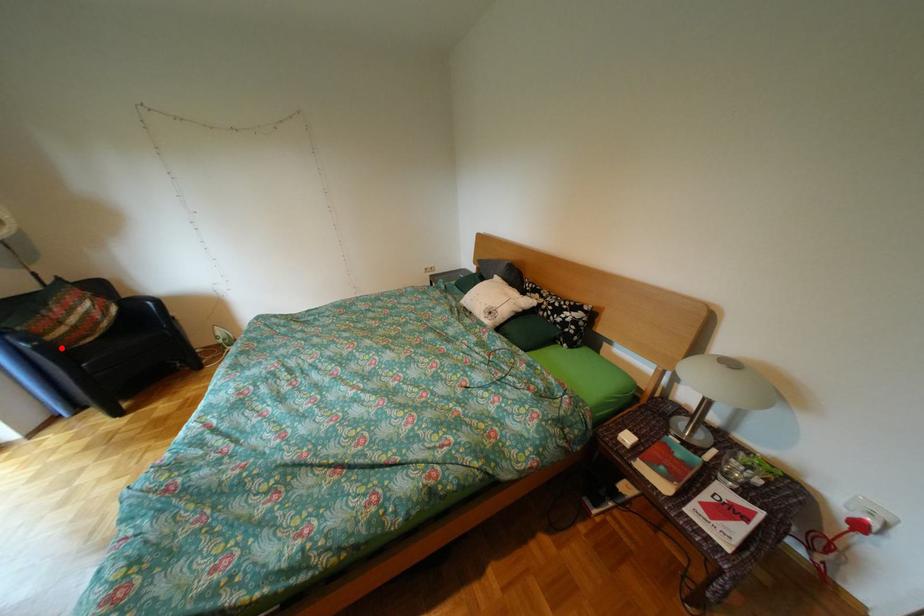
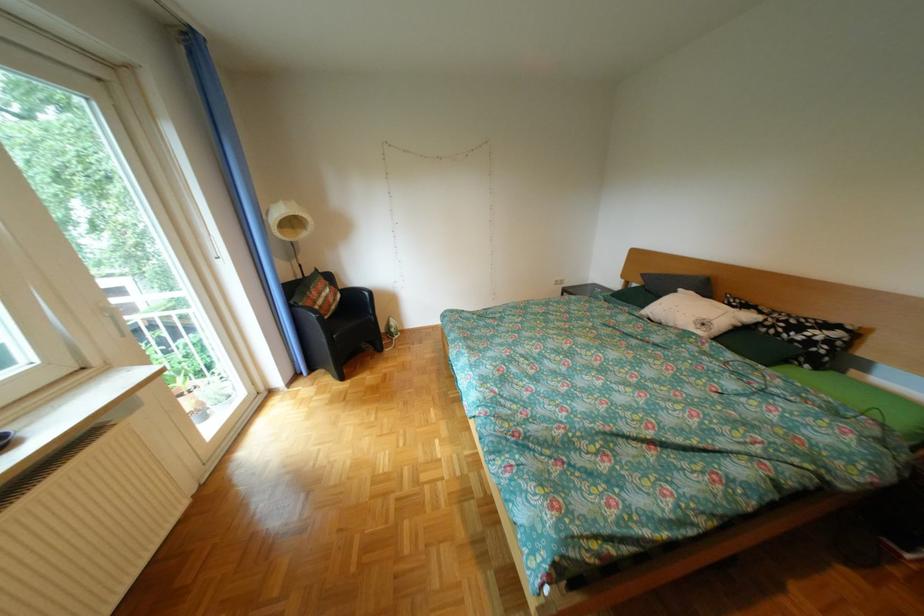
Where in the second image is the point corresponding to the highlighted location from the first image?

(334, 320)